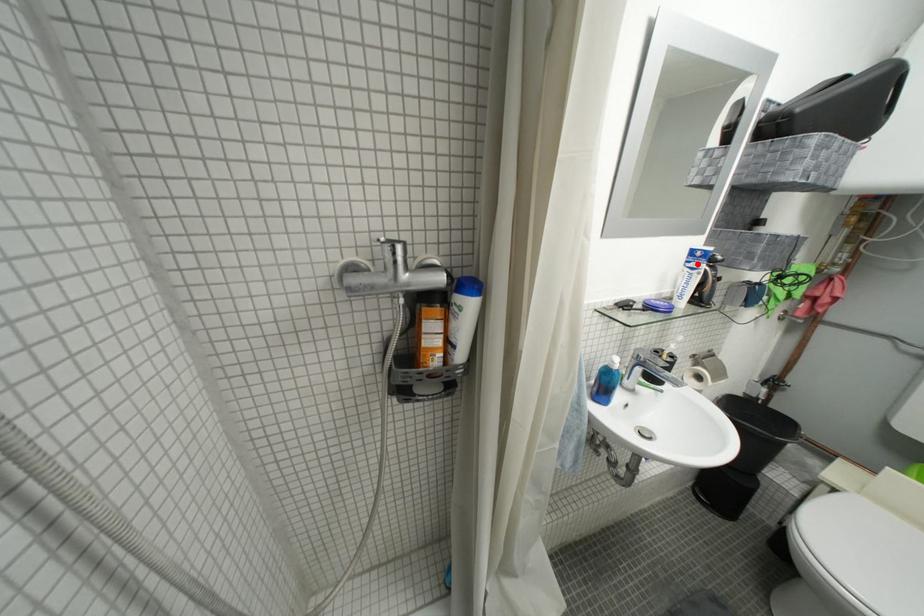
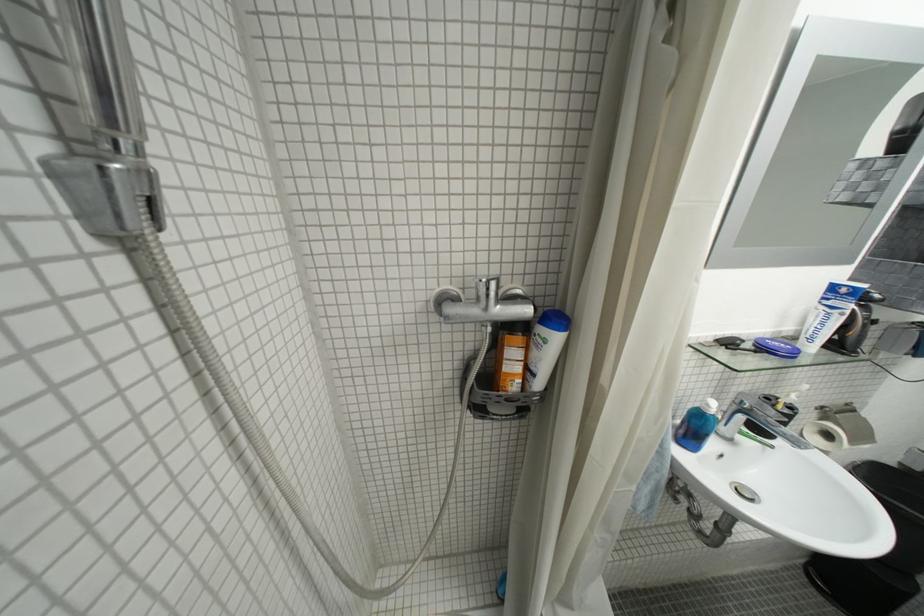
The point at the highlighted location is marked in the first image. Where is the corresponding point in the second image?

(833, 301)